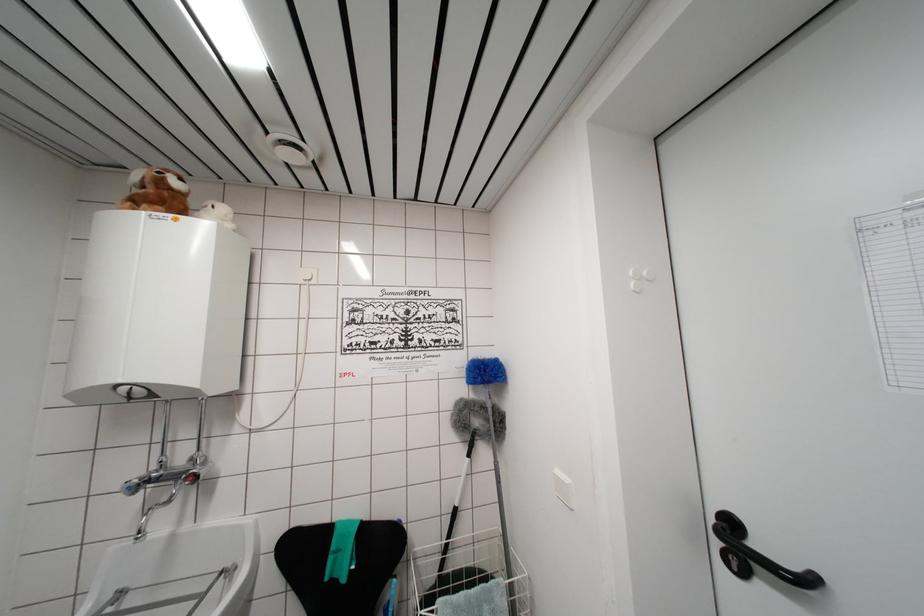
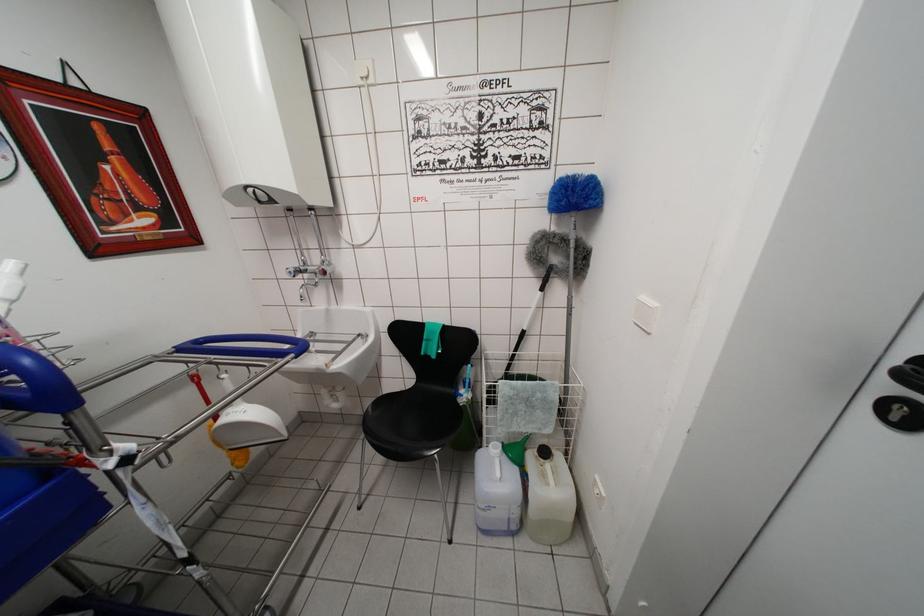
In the second image, find the point that corresponds to (x=478, y=383) in the first image.

(562, 206)